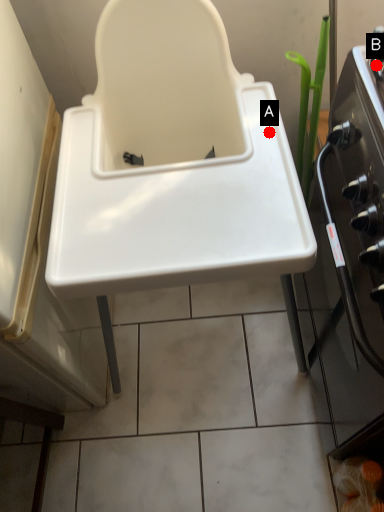
Question: Two points are circled on the image, labeled by A and B beside each circle. Which of the following is the closest to the observer?

Choices:
 (A) A is closer
 (B) B is closer

Answer: (B)